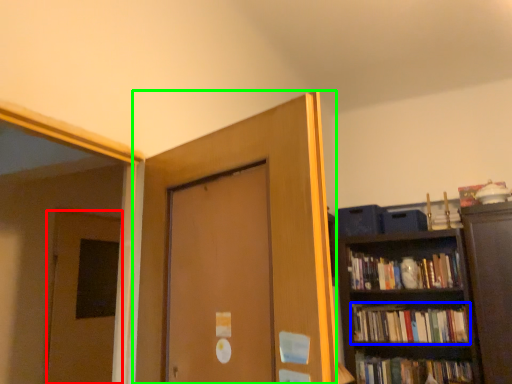
Question: Which is farther away from door (highlighted by a red box)? book (highlighted by a blue box) or door (highlighted by a green box)?

Choices:
 (A) book
 (B) door

Answer: (A)